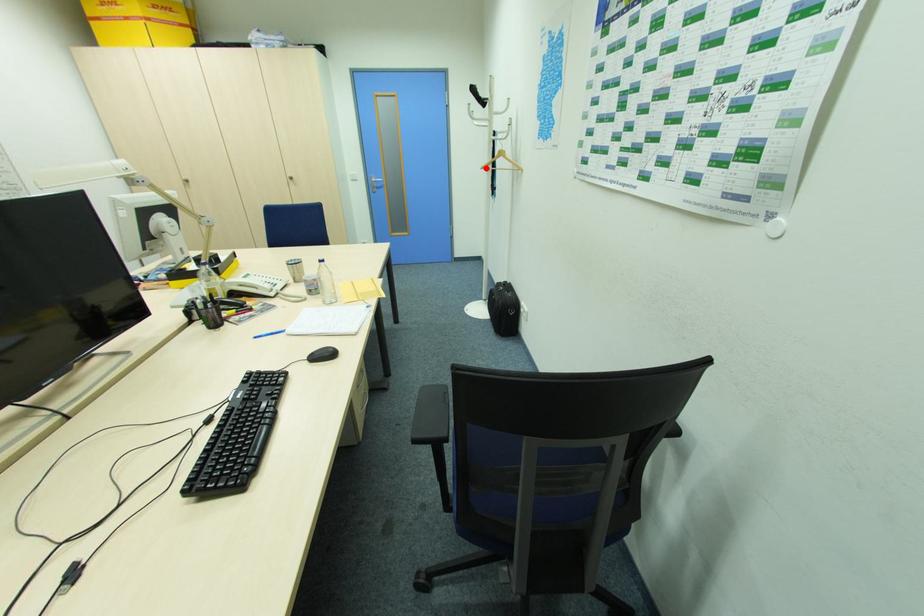
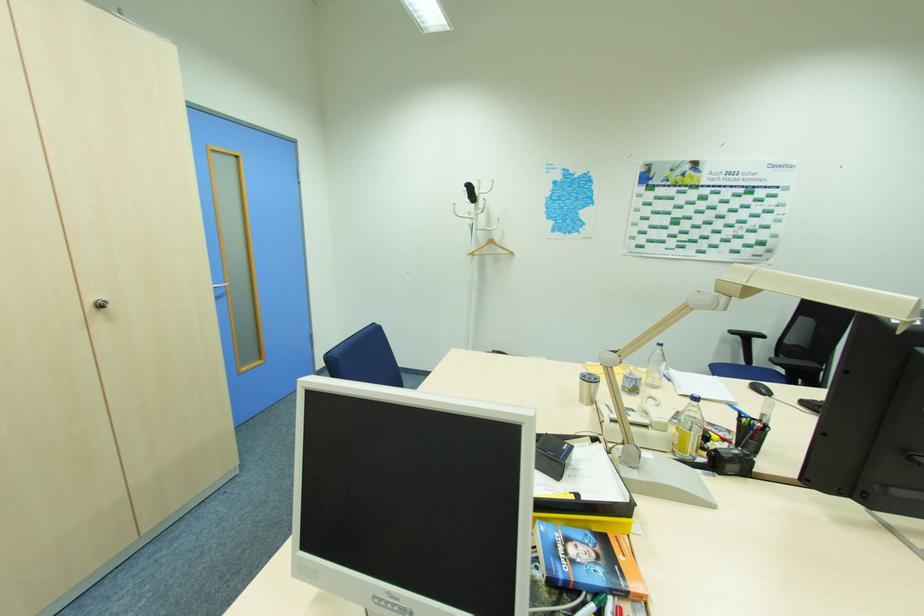
Question: I am providing you with two images of the same scene from different viewpoints. A red point is shown in image1. For the corresponding object point in image2, is it positioned nearer or farther from the camera?

Choices:
 (A) Nearer
 (B) Farther

Answer: (B)